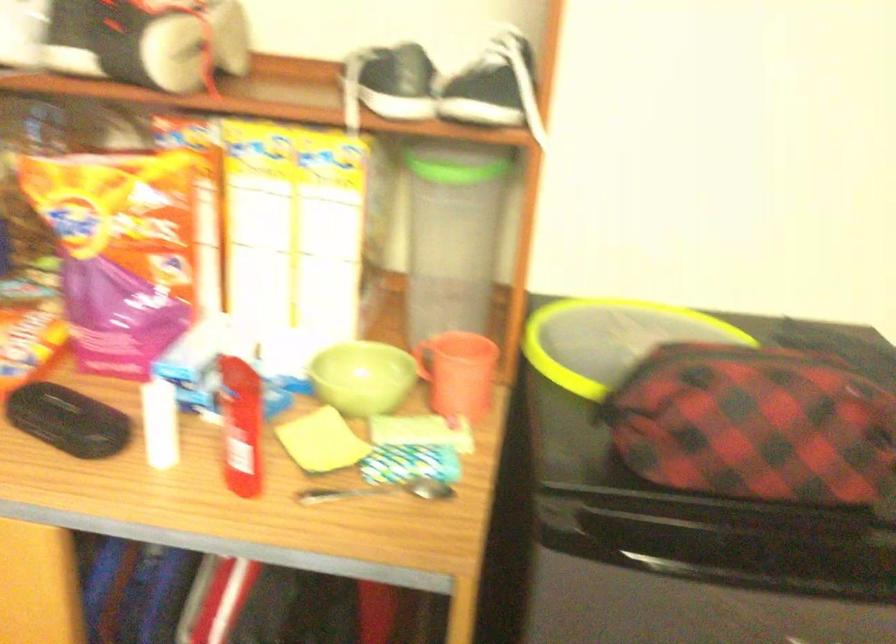
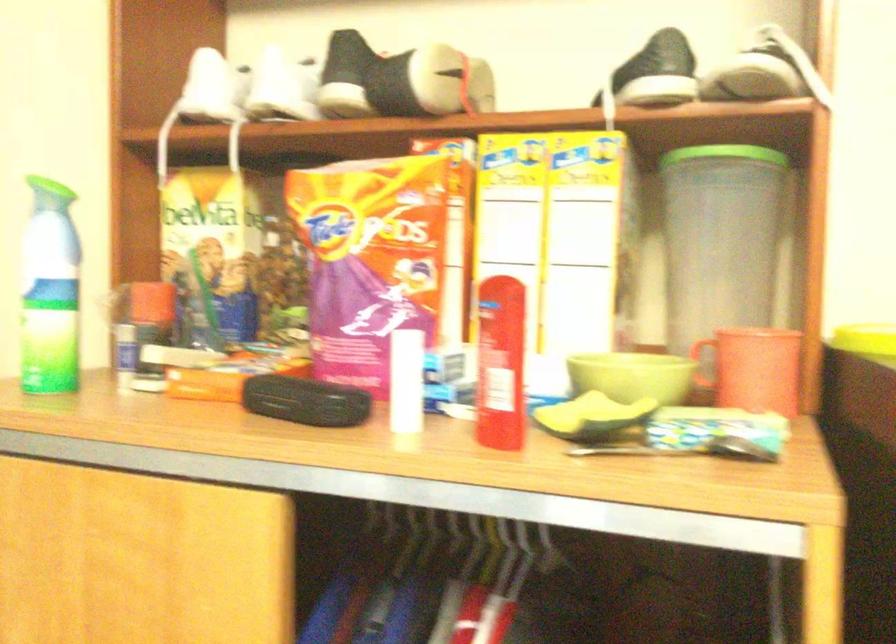
The point at (394, 93) is marked in the first image. Where is the corresponding point in the second image?

(656, 73)